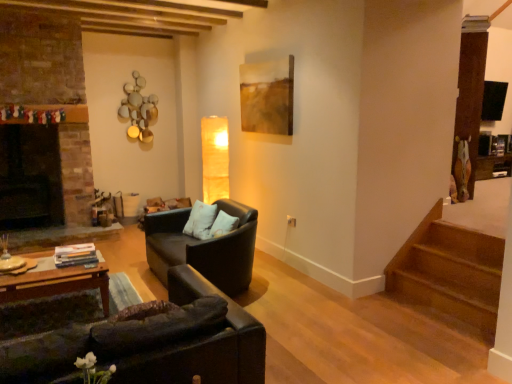
Question: Looking at the image, does matte brown painting at upper center seem bigger or smaller compared to black leather couch at lower left, which ranks as the first studio couch in front-to-back order?

Choices:
 (A) small
 (B) big

Answer: (A)

Question: Considering the positions of matte brown painting at upper center and black leather couch at lower left, which ranks as the first studio couch in front-to-back order, in the image, is matte brown painting at upper center taller or shorter than black leather couch at lower left, which ranks as the first studio couch in front-to-back order,?

Choices:
 (A) tall
 (B) short

Answer: (A)

Question: Estimate the real-world distances between objects in this image. Which object is closer to the wooden coffee table at lower left?

Choices:
 (A) matte brown painting at upper center
 (B) white soft pillow at center
 (C) black leather couch at lower left, which ranks as the first studio couch in front-to-back order
 (D) matte black couch at center, positioned as the 1th studio couch in back-to-front order

Answer: (D)

Question: Which of these objects is positioned closest to the matte brown painting at upper center?

Choices:
 (A) wooden coffee table at lower left
 (B) matte black couch at center, positioned as the 1th studio couch in back-to-front order
 (C) white soft pillow at center
 (D) black leather couch at lower left, which ranks as the first studio couch in front-to-back order

Answer: (C)